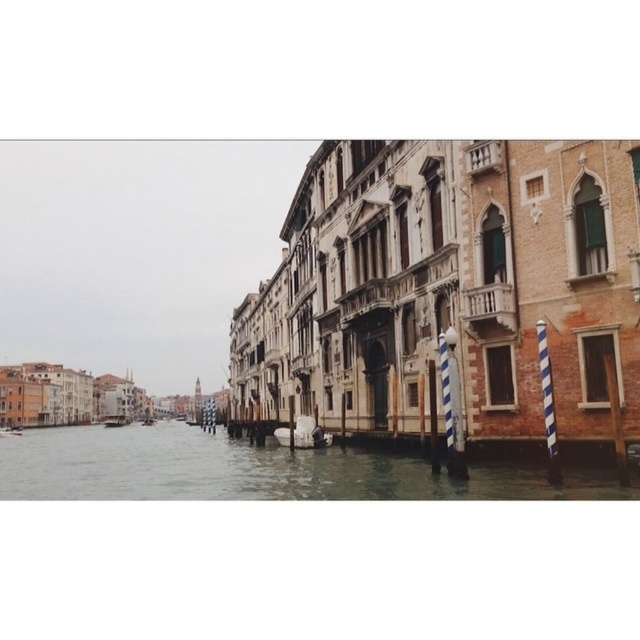
Which is more to the left, clear water at center or wooden boat at center?

From the viewer's perspective, wooden boat at center appears more on the left side.

Looking at this image, does clear water at center appear on the right side of wooden boat at center?

Correct, you'll find clear water at center to the right of wooden boat at center.

Who is more forward, (253, 461) or (120, 424)?

Point (253, 461) is in front.

Where is `clear water at center`? The image size is (640, 640). clear water at center is located at coordinates (250, 470).

Looking at this image, does clear water at center have a smaller size compared to white glossy boat at center?

No, clear water at center is not smaller than white glossy boat at center.

Can you confirm if clear water at center is positioned to the right of white glossy boat at center?

Incorrect, clear water at center is not on the right side of white glossy boat at center.

Who is more forward, (124, 464) or (316, 426)?

Point (316, 426) is in front.

This screenshot has width=640, height=640. Identify the location of clear water at center. (250, 470).

Can you confirm if white glossy boat at center is positioned to the right of wooden boat at center?

Yes, white glossy boat at center is to the right of wooden boat at center.

Is white glossy boat at center thinner than wooden boat at center?

Indeed, white glossy boat at center has a lesser width compared to wooden boat at center.

Does point (307, 429) come closer to viewer compared to point (122, 424)?

Yes, point (307, 429) is closer to viewer.

At what (x,y) coordinates should I click in order to perform the action: click on white glossy boat at center. Please return your answer as a coordinate pair (x, y). This screenshot has width=640, height=640. Looking at the image, I should click on 301,435.